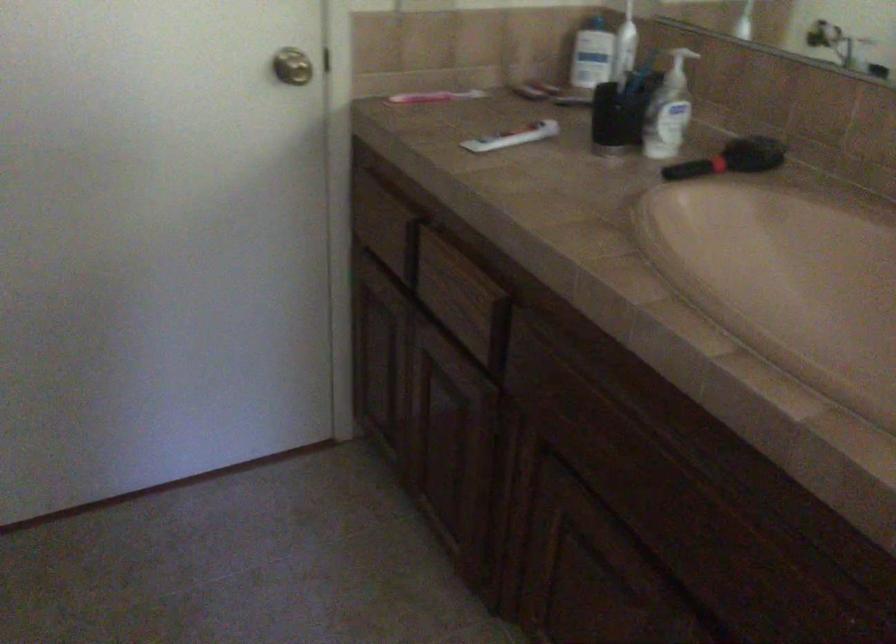
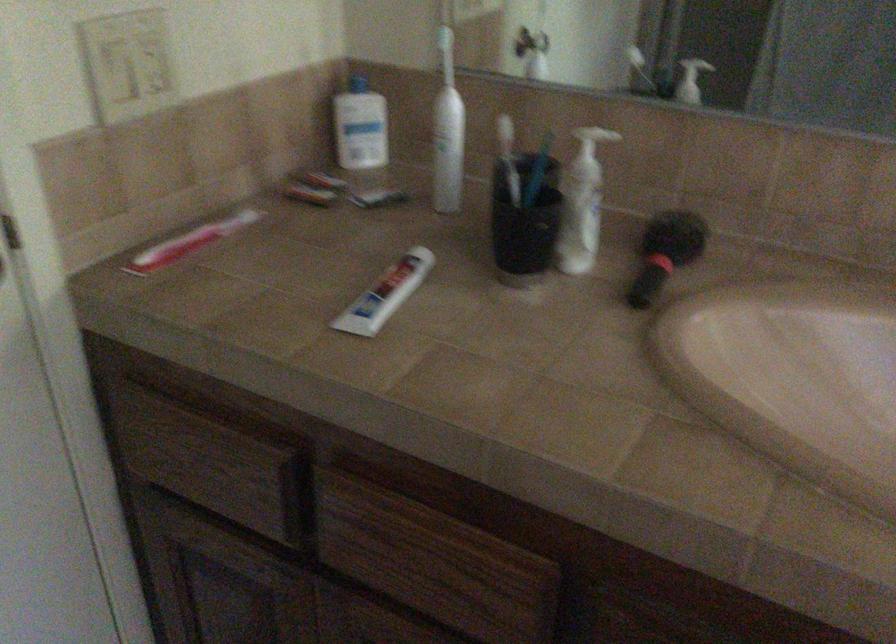
Find the pixel in the second image that matches [446,290] in the first image.

(410, 560)